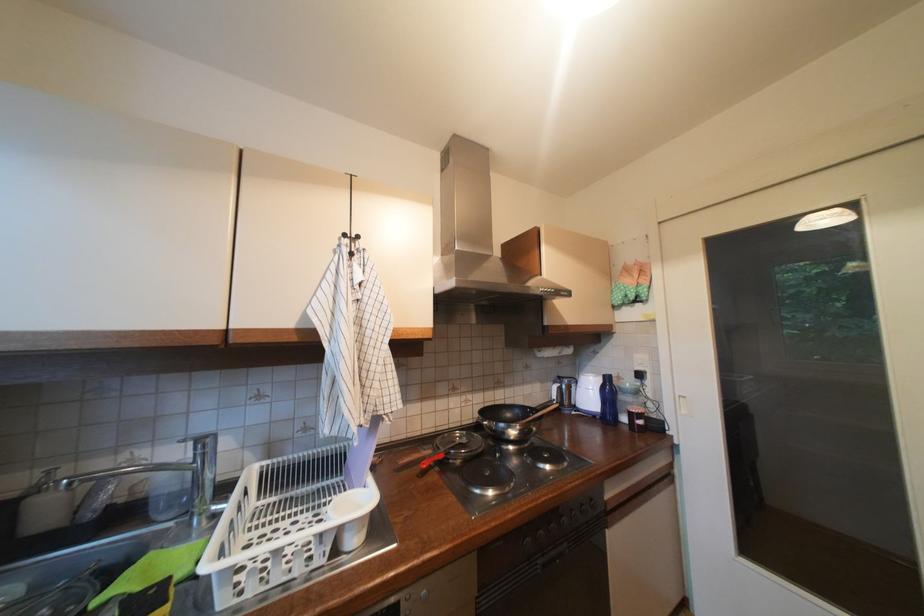
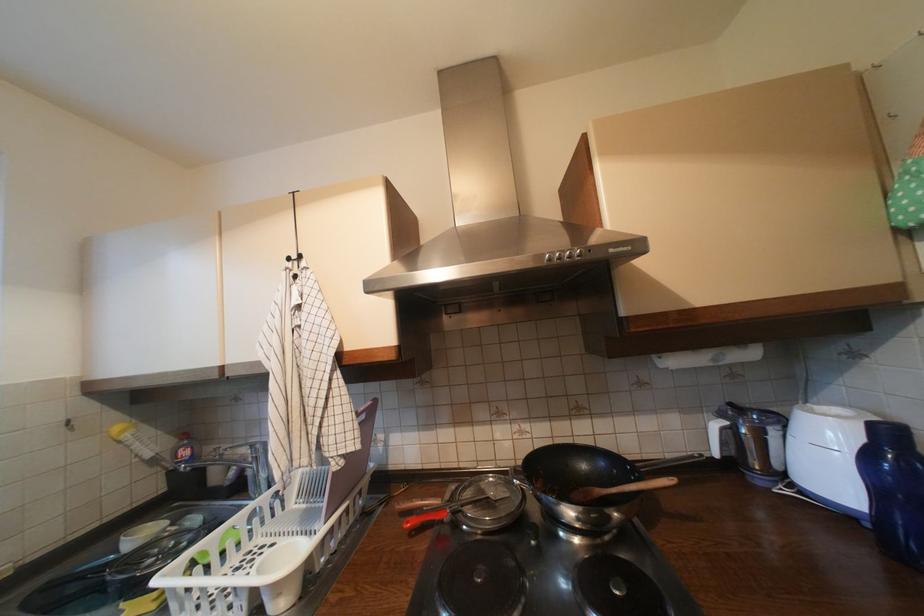
In the second image, find the point that corresponds to point (353, 236) in the first image.

(297, 260)